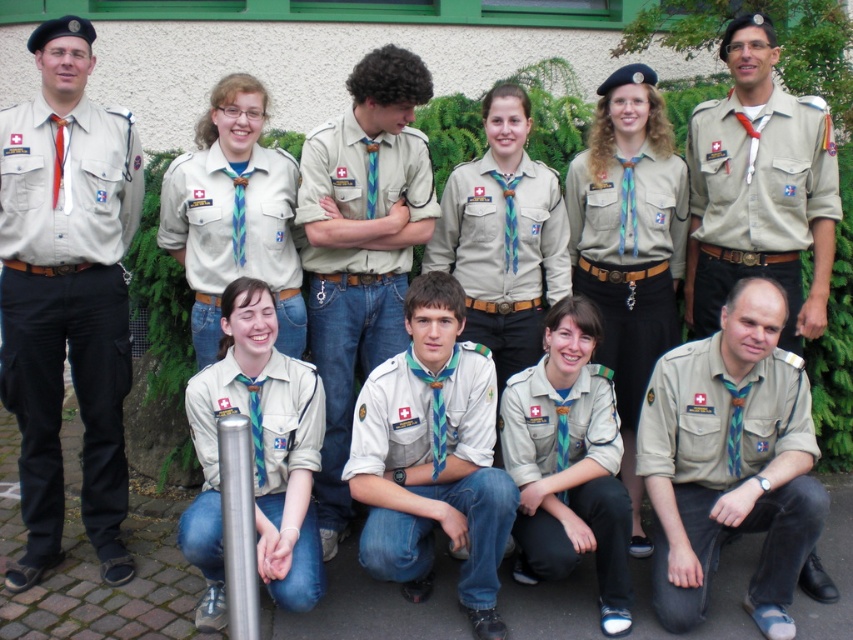
Is point (389, 529) more distant than point (335, 300)?

No.

Is white cotton shirt at center to the left of light beige fabric uniform at center from the viewer's perspective?

No, white cotton shirt at center is not to the left of light beige fabric uniform at center.

Where is `white cotton shirt at center`? white cotton shirt at center is located at coordinates (432, 458).

Does point (753, 168) come behind point (511, 280)?

No, (753, 168) is closer to viewer.

Is khaki fabric shirt at upper right taller than khaki fabric uniform at center?

Yes, khaki fabric shirt at upper right is taller than khaki fabric uniform at center.

Between point (782, 248) and point (494, 172), which one is positioned in front?

Positioned in front is point (782, 248).

The image size is (853, 640). I want to click on khaki fabric shirt at upper right, so click(757, 198).

Is light beige uniform at center thinner than beige fabric uniform at upper center?

Indeed, light beige uniform at center has a lesser width compared to beige fabric uniform at upper center.

Measure the distance between light beige uniform at center and camera.

light beige uniform at center is 3.30 meters away from camera.

Where is `light beige uniform at center`? The width and height of the screenshot is (853, 640). light beige uniform at center is located at coordinates (257, 456).